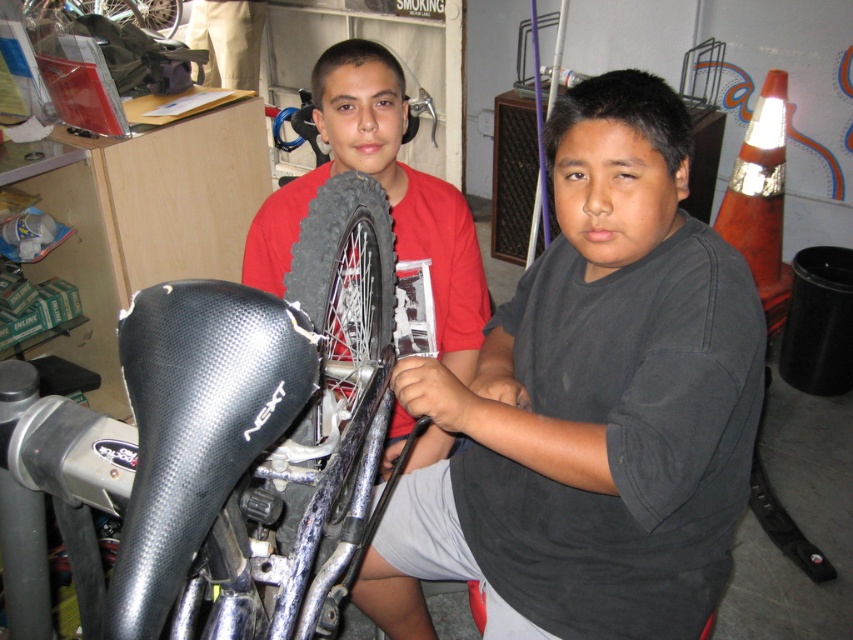
You are standing in the workshop and need to move a tool from point A to point B. Point A is at coordinates point(669,465) and point B is at coordinates point(148,12). According to the scene description, which point is closer to you?

Point(669,465) is in front of point(148,12), so point A is closer to you.

Where is the black rubber tire at center located in the image?

The black rubber tire at center is located at point coordinates (347, 278).

You are a customer in a bike repair shop. You see two items in the workshop area. One is the black matte shirt at center and the other is the shiny metallic tire at upper left. Which item takes up more space in the workshop?

The shiny metallic tire at upper left takes up more space in the workshop than the black matte shirt at center because the black matte shirt at center occupies less space than shiny metallic tire at upper left.